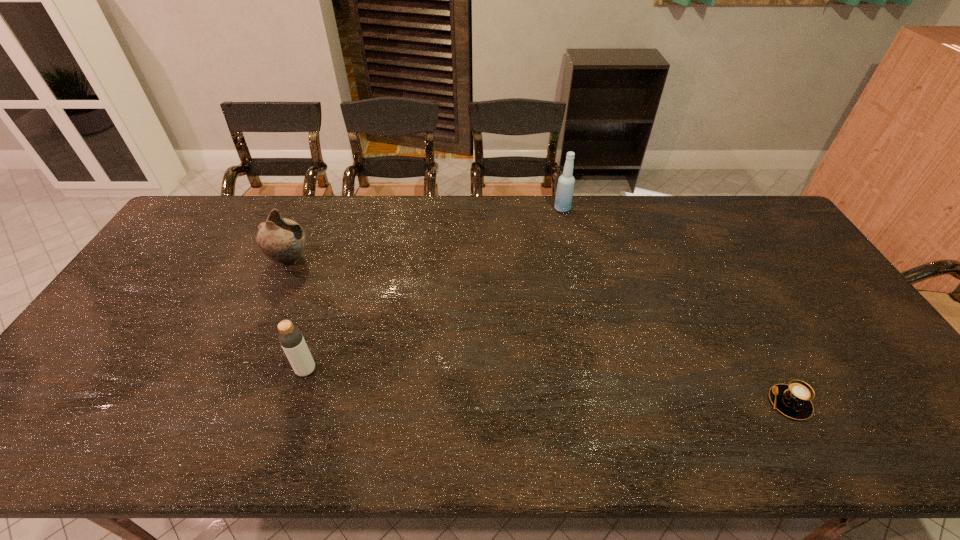
Where is `free space located on the back of the shorter bottle`? This screenshot has width=960, height=540. free space located on the back of the shorter bottle is located at coordinates (320, 328).

I want to click on vacant region located 0.290m on the left of the rightmost object, so click(x=646, y=403).

You are a GUI agent. You are given a task and a screenshot of the screen. Output one action in this format:
    pyautogui.click(x=<x>, y=<y>)
    Task: Click on the object that is positioned at the far edge
    The image size is (960, 540).
    Given the screenshot: What is the action you would take?
    [x=565, y=187]

The width and height of the screenshot is (960, 540). Identify the location of object that is at the near edge. (793, 400).

Identify the location of free region at the far edge. The height and width of the screenshot is (540, 960). (628, 235).

At what (x,y) coordinates should I click in order to perform the action: click on vacant space at the near edge of the desktop. Please return your answer as a coordinate pair (x, y). The height and width of the screenshot is (540, 960). Looking at the image, I should click on (472, 452).

Where is `vacant space at the left edge of the desktop`? vacant space at the left edge of the desktop is located at coordinates (64, 387).

At what (x,y) coordinates should I click in order to perform the action: click on vacant area at the right edge. Please return your answer as a coordinate pair (x, y). The width and height of the screenshot is (960, 540). Looking at the image, I should click on (768, 265).

Where is `free space that is in between the taller bottle and the cappuccino`? This screenshot has width=960, height=540. free space that is in between the taller bottle and the cappuccino is located at coordinates (676, 306).

Locate an element on the screen. vacant space that is in between the cappuccino and the second farthest object is located at coordinates (540, 331).